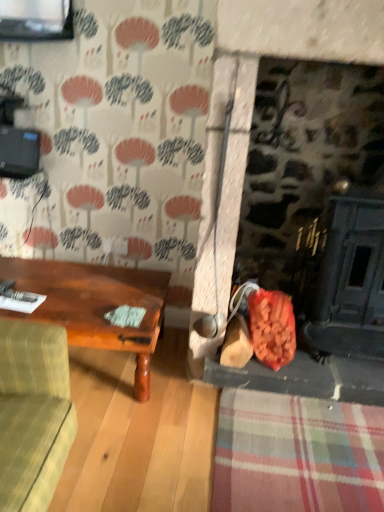
Question: Should I look upward or downward to see wooden table at center?

Choices:
 (A) up
 (B) down

Answer: (B)